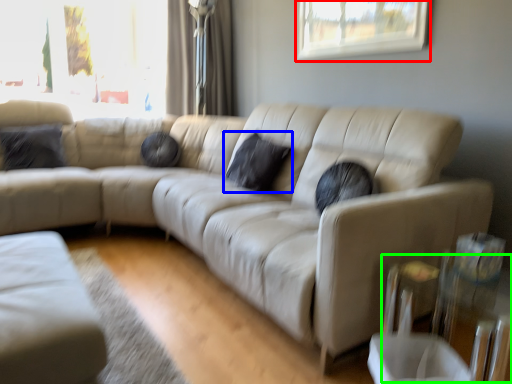
Question: Which object is positioned farthest from window (highlighted by a red box)? Select from pillow (highlighted by a blue box) and glass table (highlighted by a green box).

Choices:
 (A) pillow
 (B) glass table

Answer: (B)